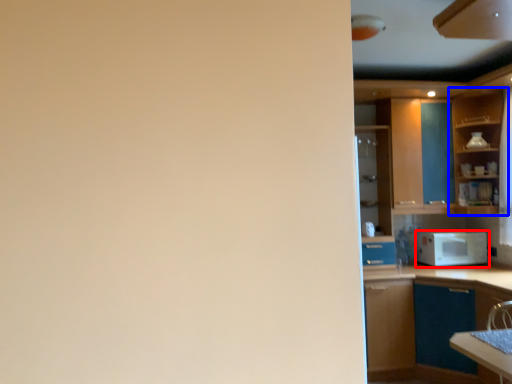
Question: Which of the following is the farthest to the observer, microwave oven (highlighted by a red box) or cabinetry (highlighted by a blue box)?

Choices:
 (A) microwave oven
 (B) cabinetry

Answer: (A)